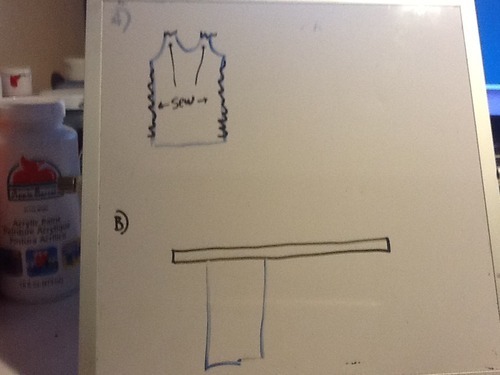
You are a GUI agent. You are given a task and a screenshot of the screen. Output one action in this format:
    pyautogui.click(x=<x>, y=<y>)
    Task: Click on the gray border on right side of board
    
    Given the screenshot: What is the action you would take?
    pyautogui.click(x=479, y=87)